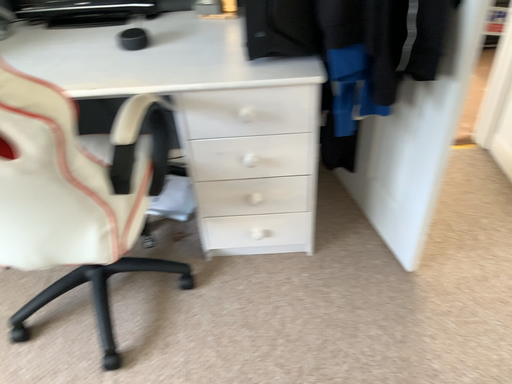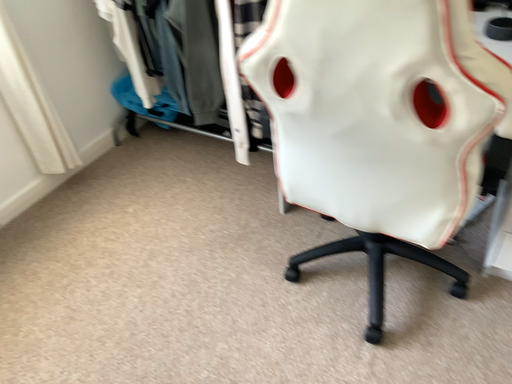
Question: Which way did the camera rotate in the video?

Choices:
 (A) rotated right
 (B) rotated left

Answer: (B)